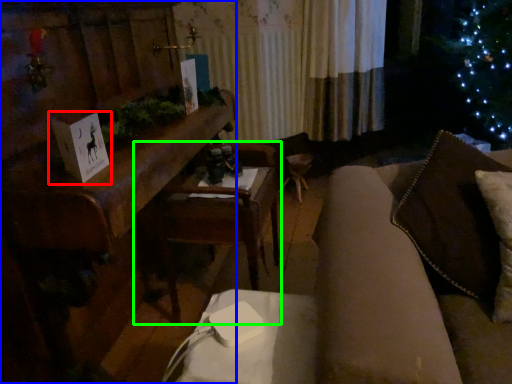
Question: Which object is positioned closest to christmas card (highlighted by a red box)? Select from furniture (highlighted by a blue box) and armchair (highlighted by a green box).

Choices:
 (A) furniture
 (B) armchair

Answer: (A)